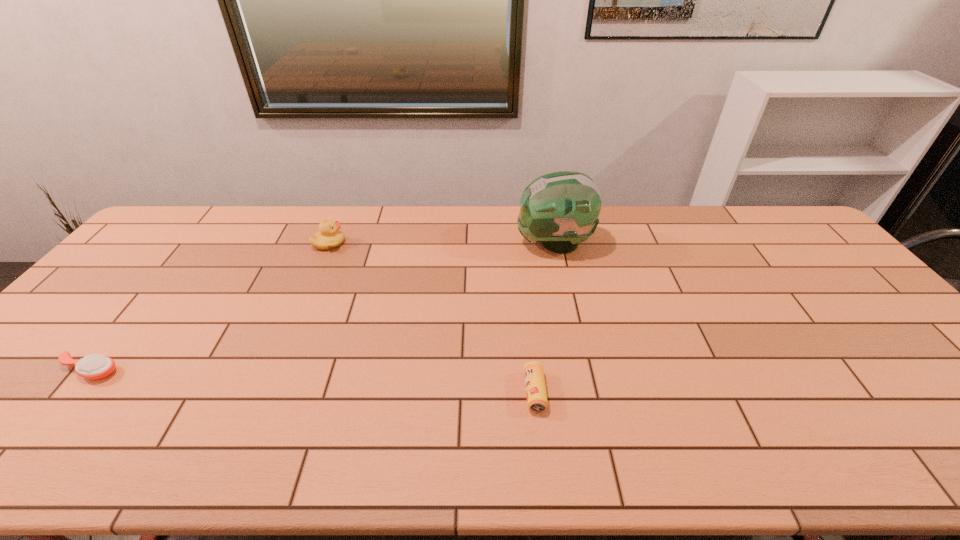
You are a GUI agent. You are given a task and a screenshot of the screen. Output one action in this format:
    pyautogui.click(x=<x>, y=<y>)
    Task: Click on the free region located on the front of the hairbrush
    Image resolution: width=960 pixels, height=540 pixels.
    Given the screenshot: What is the action you would take?
    pyautogui.click(x=27, y=447)

I want to click on football helmet that is at the far edge, so tap(560, 209).

Locate an element on the screen. This screenshot has width=960, height=540. duckling at the far edge is located at coordinates (x=329, y=237).

Locate an element on the screen. This screenshot has width=960, height=540. object present at the left edge is located at coordinates (96, 366).

In the image, there is a desktop. Where is `free space at the far edge`? Image resolution: width=960 pixels, height=540 pixels. free space at the far edge is located at coordinates (346, 207).

In the image, there is a desktop. Identify the location of vacant space at the near edge. This screenshot has height=540, width=960. [x=845, y=443].

In the image, there is a desktop. In order to click on free space at the left edge in this screenshot , I will do `click(57, 338)`.

Locate an element on the screen. vacant space at the right edge of the desktop is located at coordinates (908, 402).

In order to click on vacant space at the far right corner of the desktop in this screenshot , I will do `click(774, 211)`.

This screenshot has width=960, height=540. Identify the location of free space between the second object from left to right and the hairbrush. (209, 307).